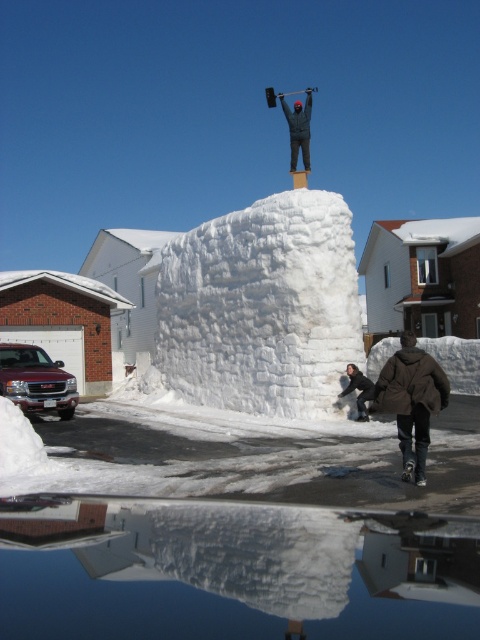
Question: In this image, where is white snow block at center located relative to white snowboard at lower right?

Choices:
 (A) below
 (B) above

Answer: (B)

Question: Does dark gray jacket at center have a larger size compared to white snowboard at lower right?

Choices:
 (A) yes
 (B) no

Answer: (A)

Question: Estimate the real-world distances between objects in this image. Which object is closer to the white snow block at center?

Choices:
 (A) brown fuzzy coat at lower right
 (B) dark gray jacket at center
 (C) white snowboard at lower right

Answer: (C)

Question: Which point is closer to the camera?

Choices:
 (A) dark gray jacket at center
 (B) brown fuzzy coat at lower right
 (C) white snowboard at lower right
 (D) white snow block at center

Answer: (B)

Question: Among these points, which one is farthest from the camera?

Choices:
 (A) (352, 369)
 (B) (277, 388)
 (C) (405, 481)

Answer: (B)

Question: Where is white snow block at center located in relation to dark gray jacket at center in the image?

Choices:
 (A) above
 (B) below

Answer: (B)